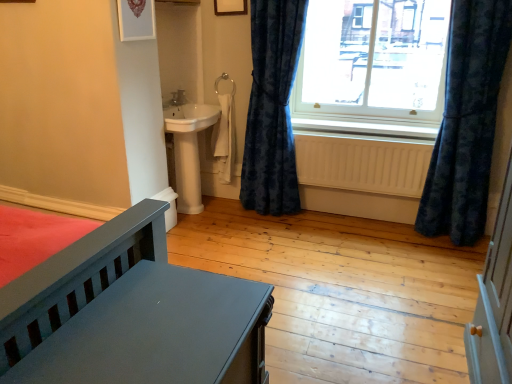
Where is `free space above matte gray bed at lower left (from a real-world perspective)`? The image size is (512, 384). free space above matte gray bed at lower left (from a real-world perspective) is located at coordinates (158, 329).